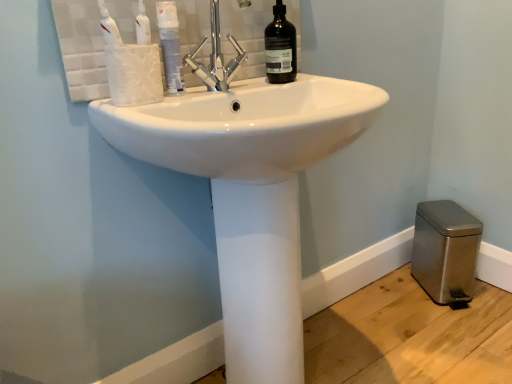
Locate an element on the screen. empty space that is to the right of white glossy sink at center is located at coordinates (416, 339).